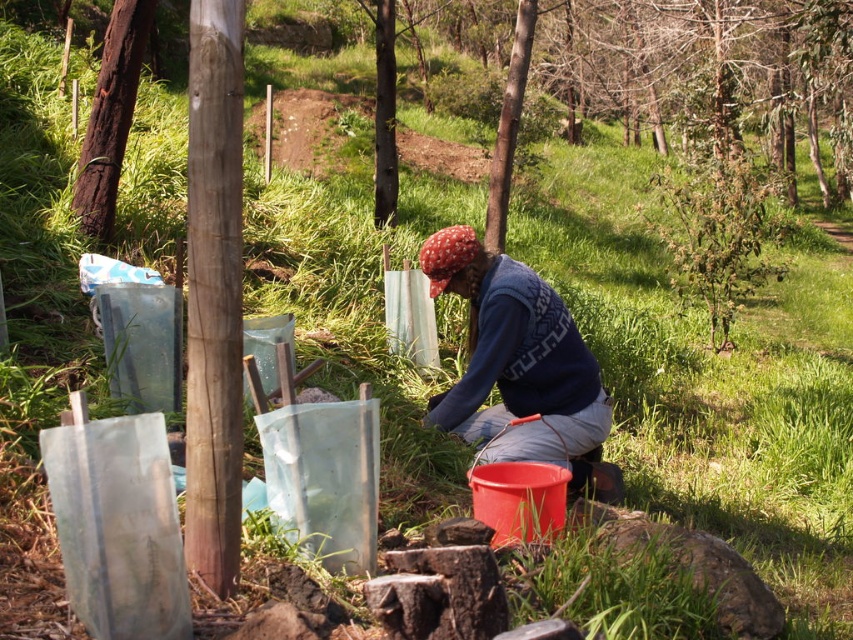
Question: Can you confirm if blue knitted sweater at center is smaller than corky bark tree at left?

Choices:
 (A) yes
 (B) no

Answer: (B)

Question: Which object is farther from the camera taking this photo?

Choices:
 (A) corky bark tree at left
 (B) blue knitted sweater at center

Answer: (A)

Question: Is blue knitted sweater at center bigger than corky bark tree at left?

Choices:
 (A) yes
 (B) no

Answer: (A)

Question: Can you confirm if blue knitted sweater at center is wider than corky bark tree at left?

Choices:
 (A) no
 (B) yes

Answer: (B)

Question: Which of the following is the farthest from the observer?

Choices:
 (A) corky bark tree at left
 (B) blue knitted sweater at center

Answer: (A)

Question: Among these objects, which one is nearest to the camera?

Choices:
 (A) corky bark tree at left
 (B) blue knitted sweater at center

Answer: (B)